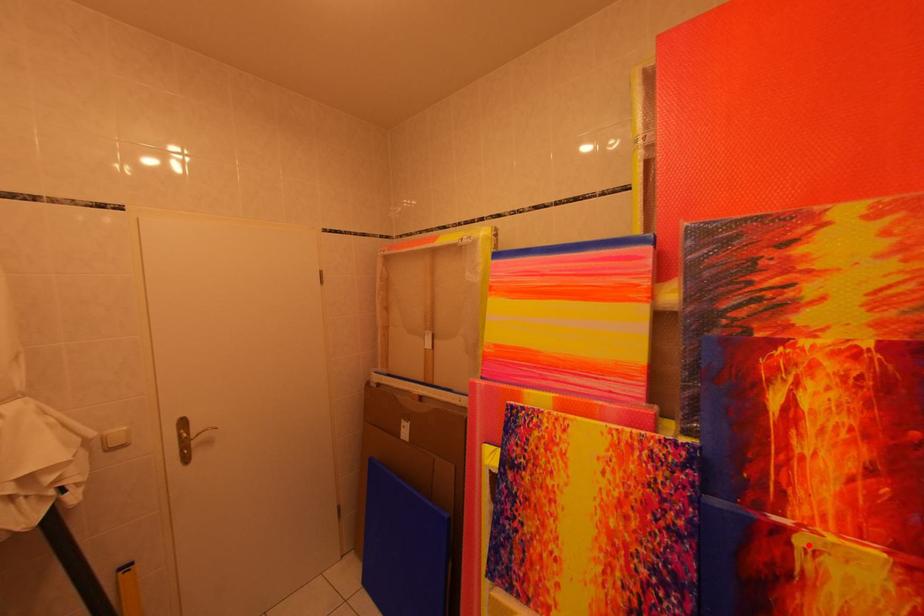
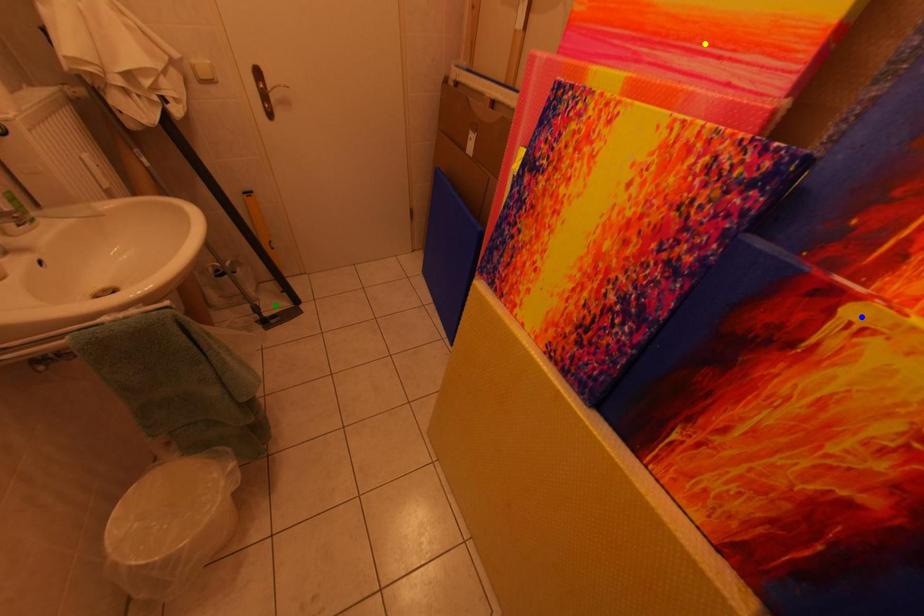
Question: I am providing you with two images of the same scene from different viewpoints. A red point is marked on the first image. You are given multiple points on the second image. Can you choose the point in image 2 that corresponds to the point in image 1?

Choices:
 (A) green point
 (B) blue point
 (C) yellow point

Answer: (B)